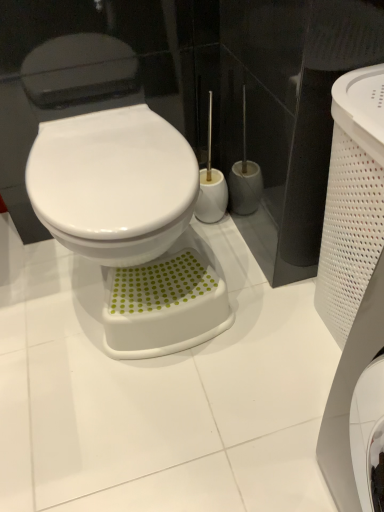
Image resolution: width=384 pixels, height=512 pixels. Find the location of `blank area to the left of green dotted plastic step stool at lower center`. blank area to the left of green dotted plastic step stool at lower center is located at coordinates click(61, 327).